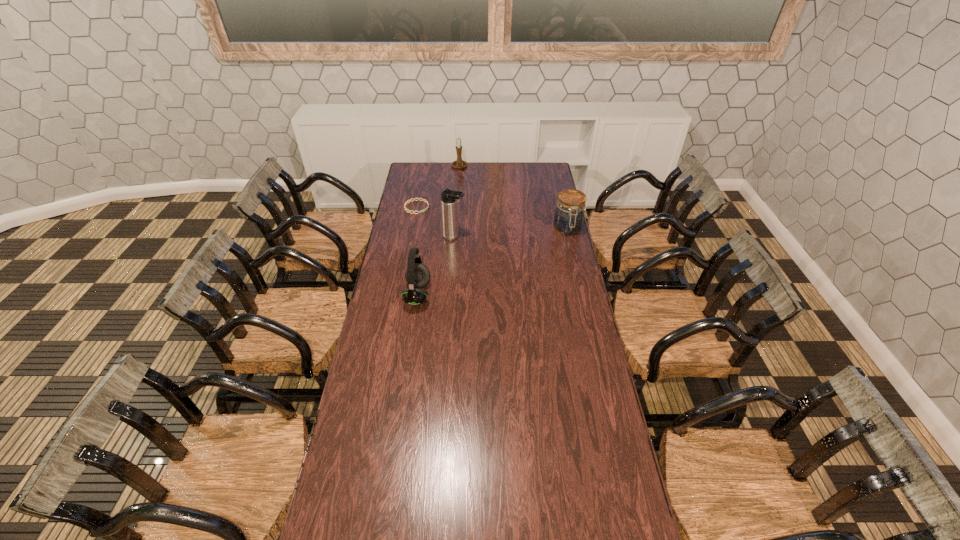
You are a GUI agent. You are given a task and a screenshot of the screen. Output one action in this format:
    pyautogui.click(x=<x>, y=<y>)
    Task: Click on the nearest object
    The image size is (960, 540).
    Given the screenshot: What is the action you would take?
    pyautogui.click(x=417, y=275)

Where is `jar`? This screenshot has height=540, width=960. jar is located at coordinates tap(568, 219).

This screenshot has width=960, height=540. I want to click on thermos bottle, so click(449, 197).

In order to click on candle holder in this screenshot , I will do `click(459, 163)`.

The image size is (960, 540). In order to click on bracelet in this screenshot , I will do `click(405, 204)`.

The height and width of the screenshot is (540, 960). I want to click on the shortest object, so click(x=405, y=204).

In order to click on free space located on the ear cups of the headset in this screenshot , I will do `click(468, 294)`.

At what (x,y) coordinates should I click in order to perform the action: click on vacant space situated on the lid of the jar. Please return your answer as a coordinate pair (x, y). Looking at the image, I should click on (582, 291).

Locate an element on the screen. vacant space situated on the handle side of the tallest object is located at coordinates (495, 251).

Where is `vacant space located on the handle side of the tallest object`? This screenshot has height=540, width=960. vacant space located on the handle side of the tallest object is located at coordinates (485, 247).